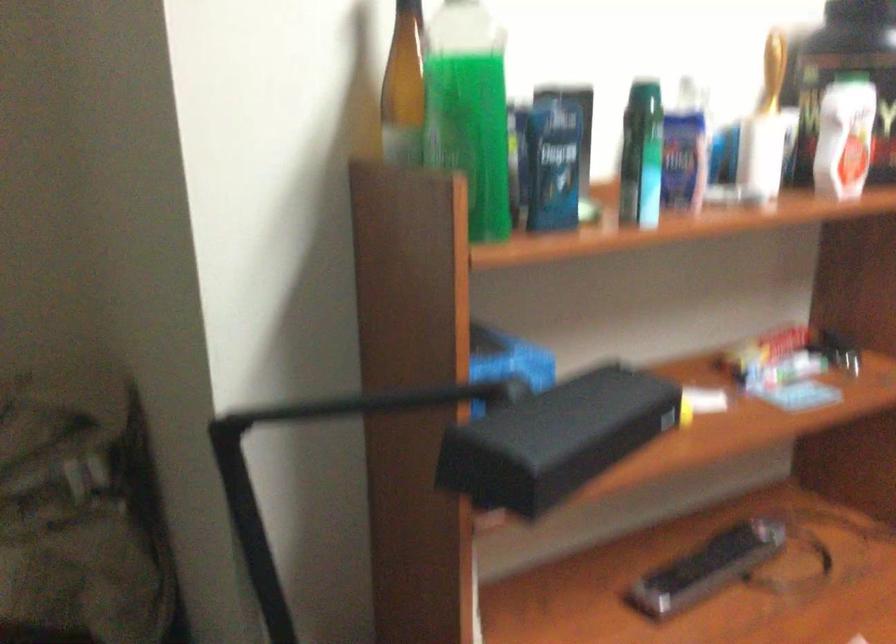
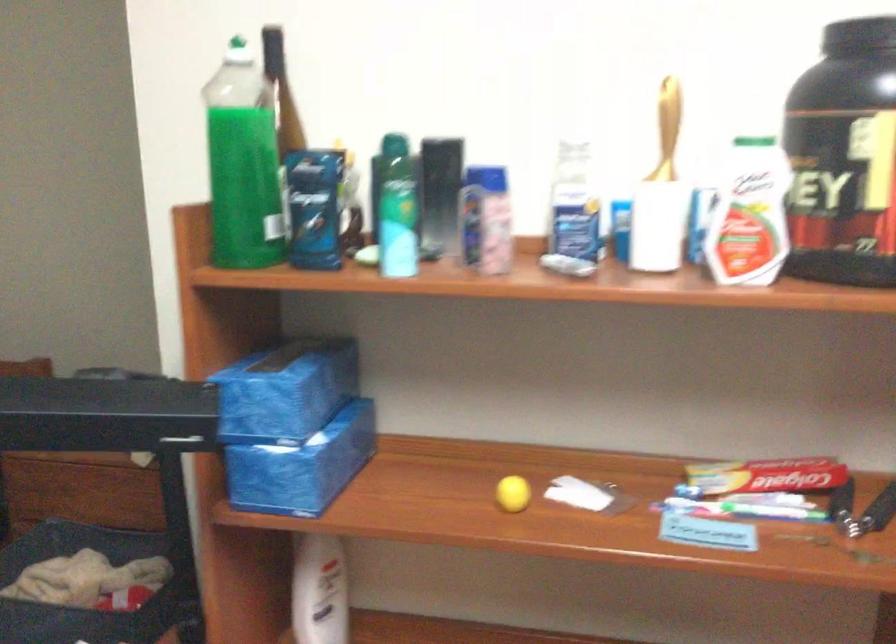
Question: I am providing you with two images of the same scene from different viewpoints. After the viewpoint changes to image2, which objects are now occluded?

Choices:
 (A) hand grip handle
 (B) green toothbrush
 (C) white and red bottle
 (D) none of these

Answer: (D)